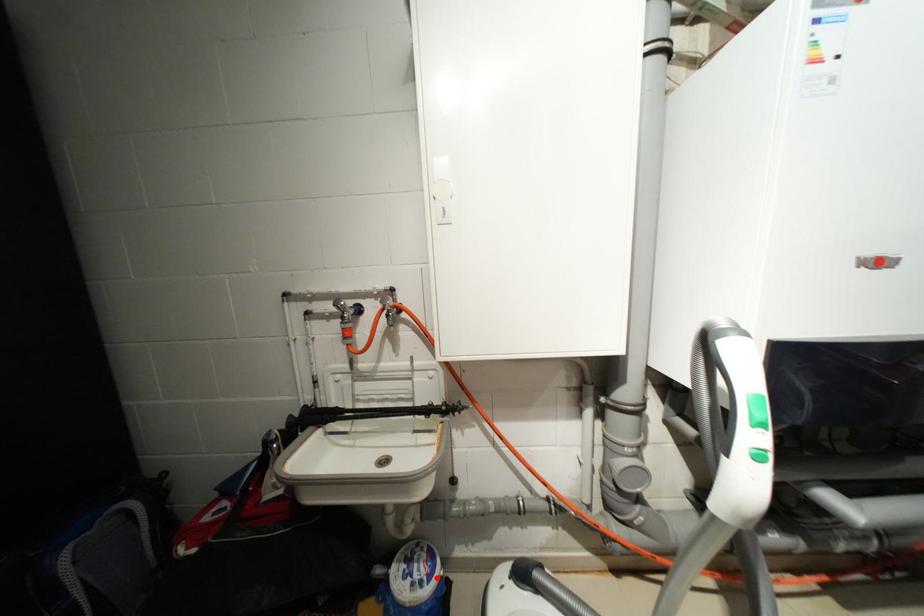
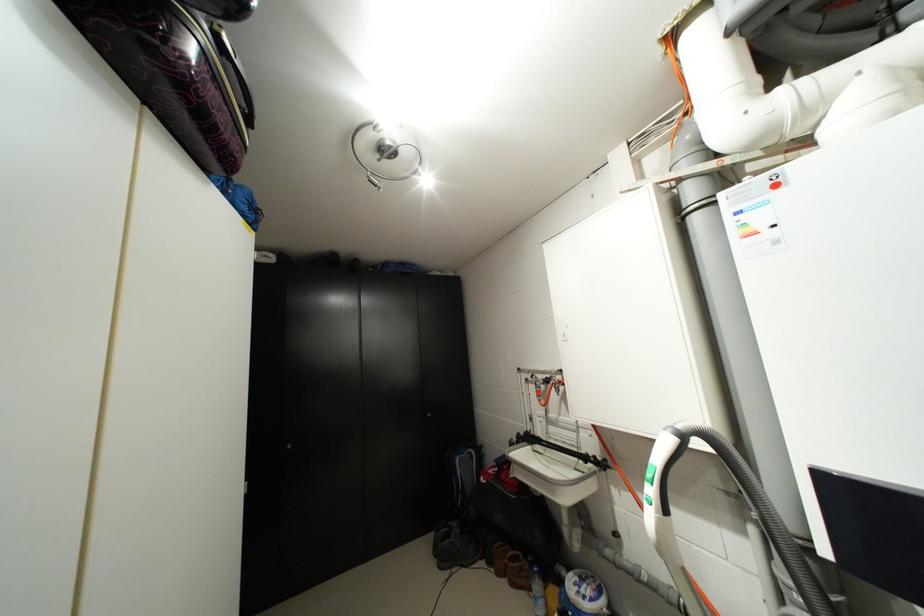
In the second image, find the point that corresponds to the highlighted location in the first image.

(599, 600)